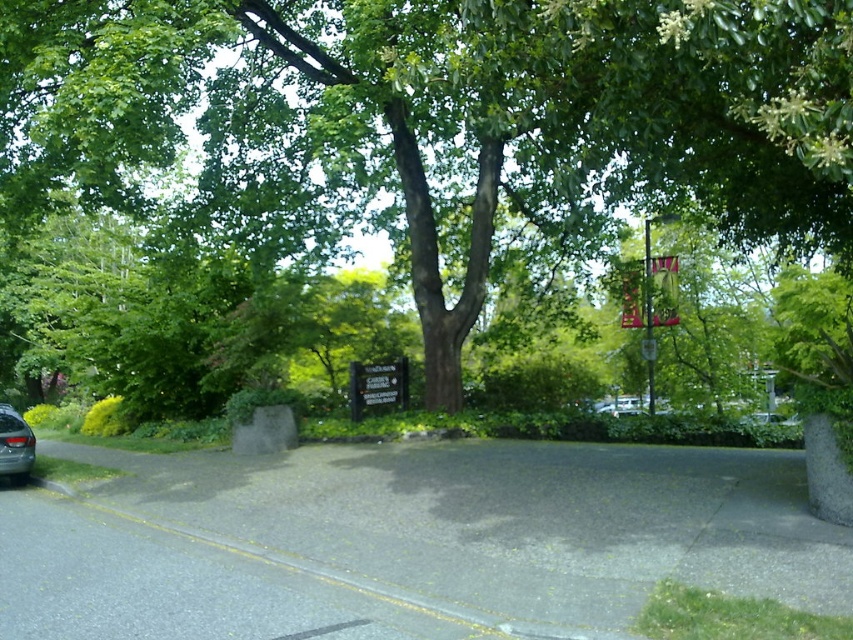
Is green leafy tree at center above silver metallic car at lower left?

Indeed, green leafy tree at center is positioned over silver metallic car at lower left.

Can you confirm if green leafy tree at center is taller than silver metallic car at lower left?

Yes.

In order to click on green leafy tree at center in this screenshot , I will do `click(439, 118)`.

I want to click on green leafy tree at center, so click(439, 118).